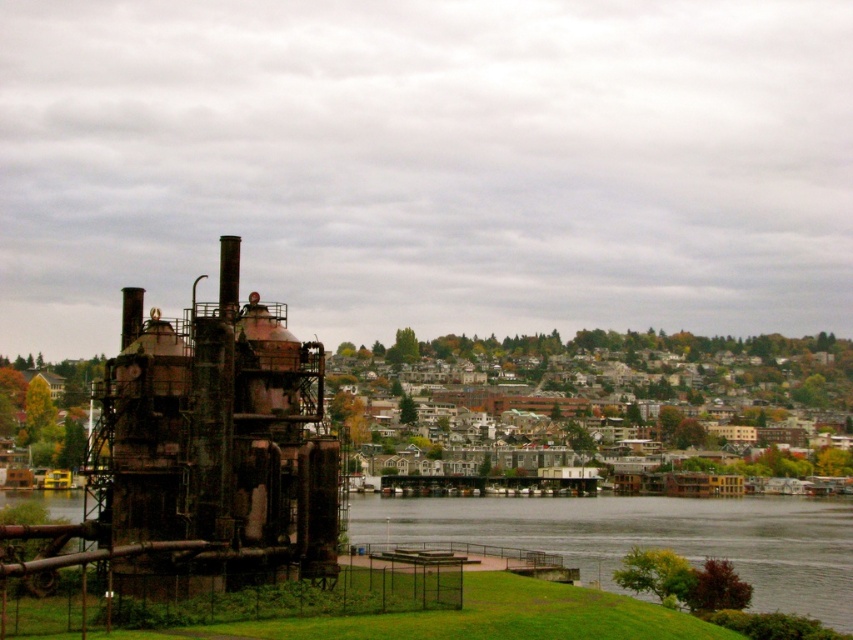
Is rusty metal structure at left smaller than rusty metal industrial structure at left?

Yes, rusty metal structure at left is smaller than rusty metal industrial structure at left.

Does rusty metal structure at left come behind rusty metal industrial structure at left?

No, rusty metal structure at left is closer to the viewer.

What do you see at coordinates (213, 448) in the screenshot? The image size is (853, 640). I see `rusty metal structure at left` at bounding box center [213, 448].

Locate an element on the screen. The width and height of the screenshot is (853, 640). rusty metal structure at left is located at coordinates (213, 448).

Who is taller, rusty metal industrial structure at left or dark gray water at lower center?

rusty metal industrial structure at left

The image size is (853, 640). What do you see at coordinates (621, 378) in the screenshot?
I see `rusty metal industrial structure at left` at bounding box center [621, 378].

The height and width of the screenshot is (640, 853). What do you see at coordinates (621, 378) in the screenshot?
I see `rusty metal industrial structure at left` at bounding box center [621, 378].

In order to click on rusty metal industrial structure at left in this screenshot , I will do `click(621, 378)`.

Who is more distant from viewer, (x=132, y=416) or (x=352, y=508)?

Positioned behind is point (x=352, y=508).

In order to click on rusty metal structure at left in this screenshot , I will do `click(213, 448)`.

Find the location of a particular element. The image size is (853, 640). rusty metal structure at left is located at coordinates (213, 448).